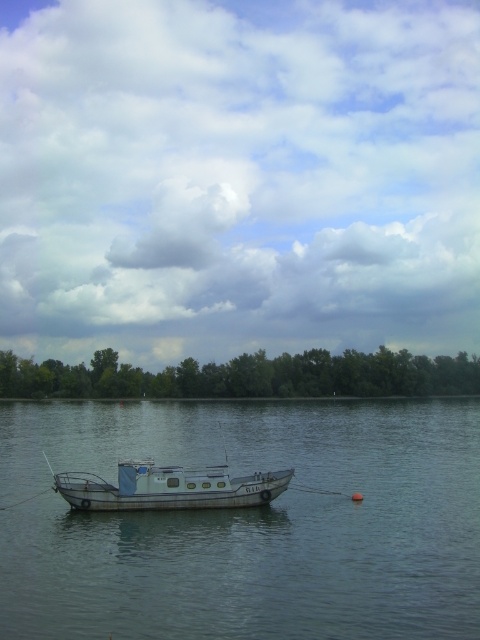
What is the exact coordinate of the cloudy sky at upper center in the image?

The cloudy sky at upper center is located at point (238, 177).

You are a photographer standing at the shore of the lake, and you want to take a photo of the boat. You notice two points marked on your camera screen at coordinates point [208,148] and point [242,506]. Which point is closer to the camera?

Point [208,148] is further to the camera than point [242,506]. Therefore, point [242,506] is closer to the camera.

You are standing on the shore looking at the cloudy sky at upper center and the white matte boat at center. Which object is closer to your eyes?

The cloudy sky at upper center is closer to your eyes because it is further to the viewer than the white matte boat at center.